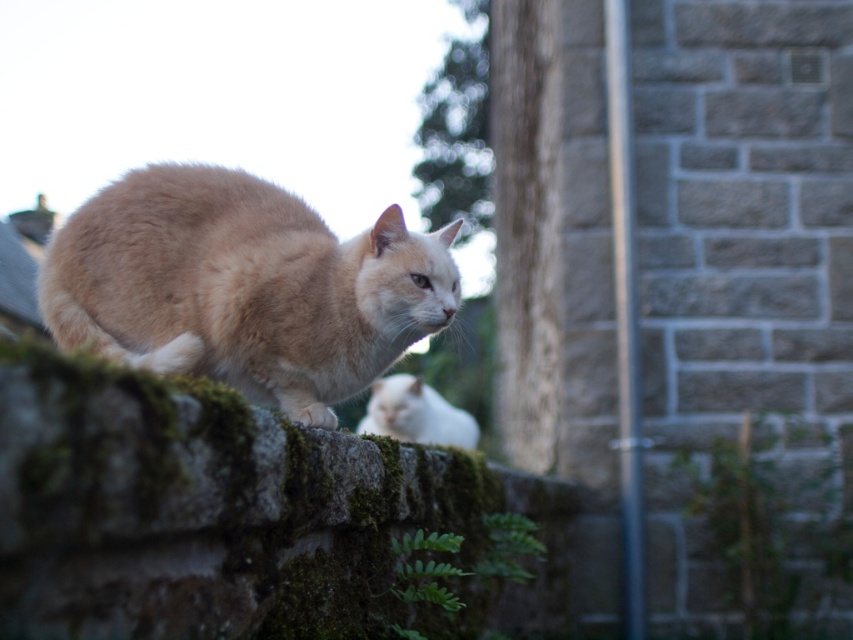
The image size is (853, 640). What do you see at coordinates (242, 285) in the screenshot?
I see `light brown fur cat at center` at bounding box center [242, 285].

What are the coordinates of `light brown fur cat at center` in the screenshot? It's located at (242, 285).

In order to click on light brown fur cat at center in this screenshot , I will do `click(242, 285)`.